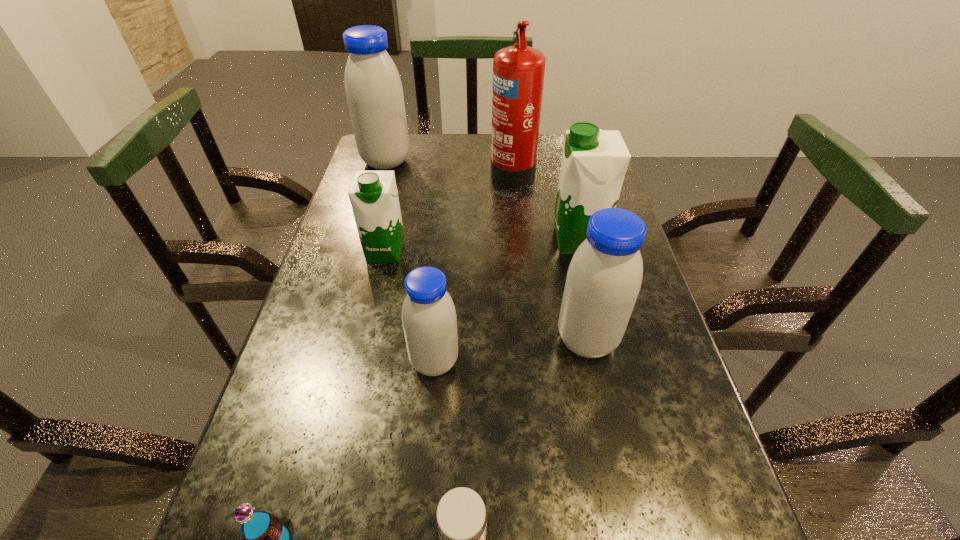
Image resolution: width=960 pixels, height=540 pixels. I want to click on object that is the fourth nearest to the second biggest blue soya milk, so click(373, 195).

At what (x,y) coordinates should I click in order to perform the action: click on object that ranks as the second closest to the second smallest blue soya milk. Please return your answer as a coordinate pair (x, y). The image size is (960, 540). Looking at the image, I should click on (429, 320).

The image size is (960, 540). I want to click on soya milk that is the third closest one to the second smallest blue soya milk, so click(373, 195).

Point out which soya milk is positioned as the nearest to the shortest object. Please provide its 2D coordinates. Your answer should be formatted as a tuple, i.e. [(x, y)], where the tuple contains the x and y coordinates of a point satisfying the conditions above.

[(429, 320)]

Identify the location of the closest blue soya milk to the rightmost blue soya milk. (429, 320).

Identify which blue soya milk is the closest to the second blue soya milk from left to right. Please provide its 2D coordinates. Your answer should be formatted as a tuple, i.e. [(x, y)], where the tuple contains the x and y coordinates of a point satisfying the conditions above.

[(604, 277)]

The image size is (960, 540). What are the coordinates of `blank area in the image that satisfies the following two spatial constraints: 1. on the surface of the red fire extinguisher; 2. on the front-facing side of the left green soya milk` in the screenshot? It's located at (520, 252).